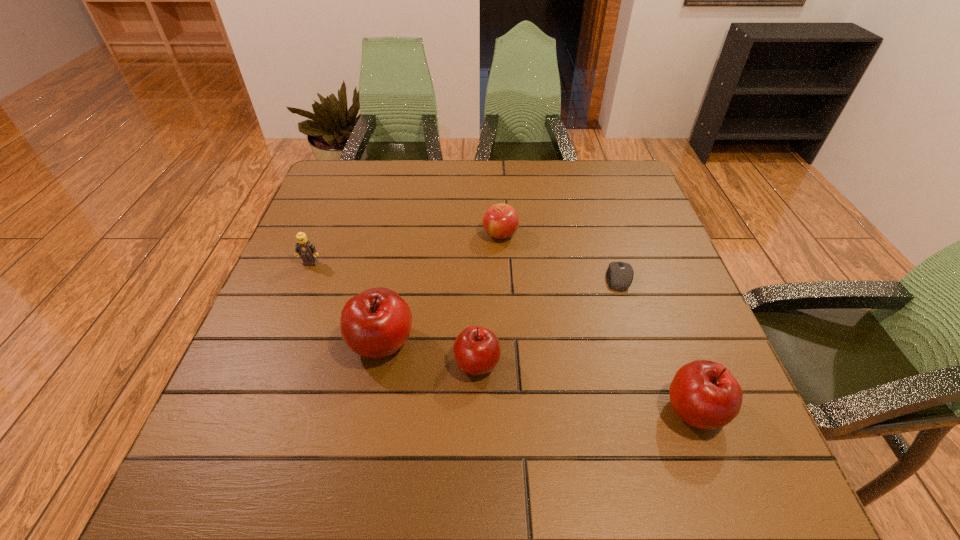
This screenshot has width=960, height=540. In order to click on the tallest object in this screenshot , I will do `click(375, 323)`.

Identify the location of the fifth object from right to left. (375, 323).

The image size is (960, 540). Find the location of `the third tallest apple`. the third tallest apple is located at coordinates (477, 351).

The height and width of the screenshot is (540, 960). I want to click on the rightmost apple, so click(704, 394).

Identify the location of the fifth shortest object. (704, 394).

Where is `the farthest apple`? This screenshot has height=540, width=960. the farthest apple is located at coordinates (500, 221).

I want to click on the farthest object, so click(500, 221).

At what (x,y) coordinates should I click in order to perform the action: click on Lego. Please return your answer as a coordinate pair (x, y). Looking at the image, I should click on (306, 249).

Locate an element on the screen. the shortest object is located at coordinates (619, 276).

Find the location of a particular element. The height and width of the screenshot is (540, 960). vacant space located 0.110m on the front of the tallest apple is located at coordinates (366, 424).